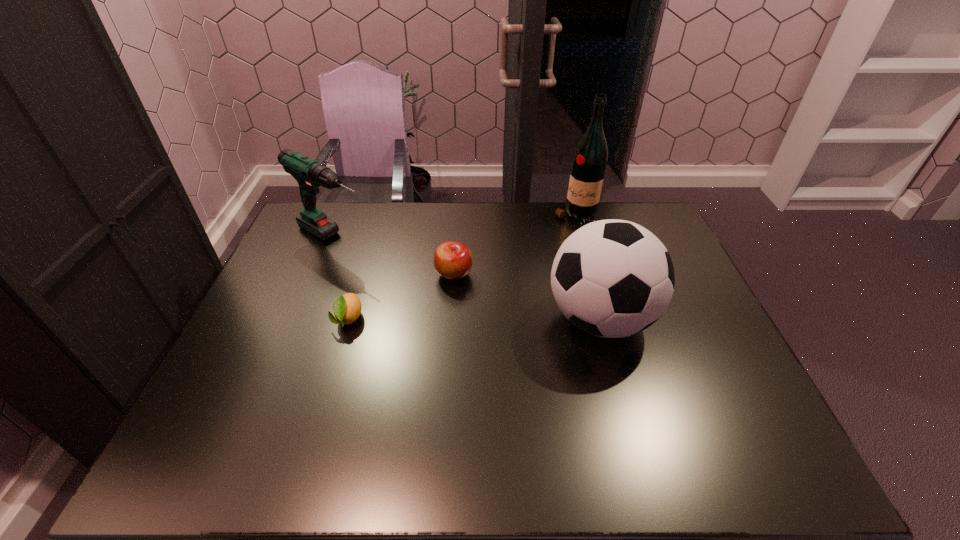
Where is `object at the right edge`? The width and height of the screenshot is (960, 540). object at the right edge is located at coordinates (612, 278).

I want to click on object present at the far left corner, so click(310, 175).

At what (x,y) coordinates should I click in order to perform the action: click on free space at the far edge of the desktop. Please return your answer as a coordinate pair (x, y). Looking at the image, I should click on (413, 225).

I want to click on vacant area at the near edge of the desktop, so click(x=610, y=390).

Image resolution: width=960 pixels, height=540 pixels. In the image, there is a desktop. What are the coordinates of `vacant region at the left edge` in the screenshot? It's located at (273, 378).

Locate an element on the screen. The height and width of the screenshot is (540, 960). vacant space at the right edge is located at coordinates (697, 323).

Where is `vacant space in between the lemon and the soccer ball`? Image resolution: width=960 pixels, height=540 pixels. vacant space in between the lemon and the soccer ball is located at coordinates (474, 319).

The image size is (960, 540). Identify the location of unoccupied area between the soccer ball and the lemon. (474, 319).

The height and width of the screenshot is (540, 960). In order to click on free area in between the wine bottle and the apple in this screenshot , I will do `click(516, 246)`.

Locate an element on the screen. The image size is (960, 540). unoccupied area between the tallest object and the third object from right to left is located at coordinates (516, 246).